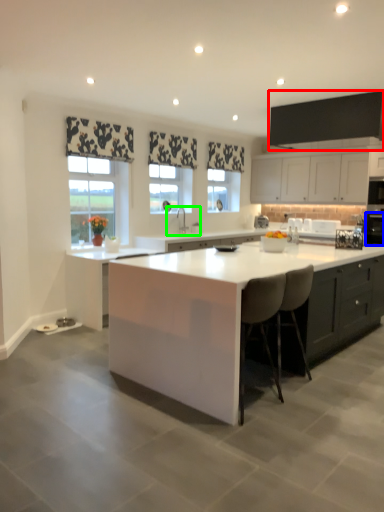
Question: Which object is positioned farthest from cabinetry (highlighted by a red box)? Select from appliance (highlighted by a blue box) and sink (highlighted by a green box).

Choices:
 (A) appliance
 (B) sink

Answer: (B)